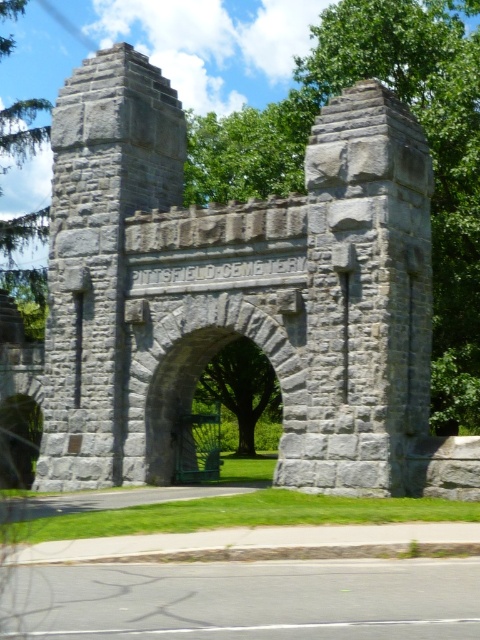
From the picture: Is gray stone gate at center wider than gray stone archway at center?

Yes.

Is point (85, 486) positioned behind point (226, 294)?

Yes, it is.

Who is more forward, (317, 349) or (188, 326)?

Point (317, 349) is more forward.

Image resolution: width=480 pixels, height=640 pixels. Find the location of `gray stone gate at center`. gray stone gate at center is located at coordinates (232, 288).